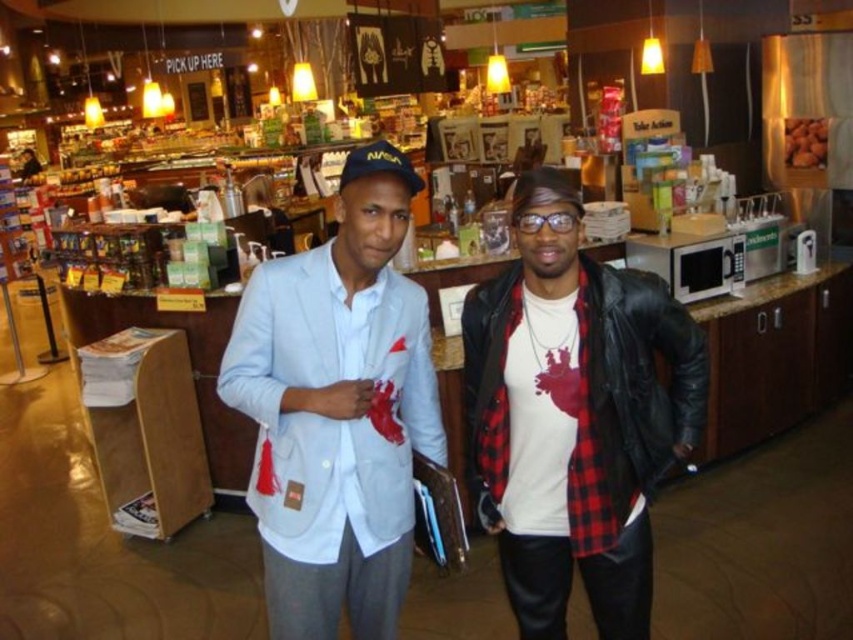
Is point (538, 515) farther from camera compared to point (350, 598)?

No.

Is matte black jacket at center wider than light blue fabric jacket at center?

Yes, matte black jacket at center is wider than light blue fabric jacket at center.

Is point (691, 317) behind point (344, 208)?

Yes, it is.

Locate an element on the screen. matte black jacket at center is located at coordinates (573, 416).

Does point (637, 284) lie in front of point (271, 445)?

No.

Is point (645, 572) more distant than point (430, 424)?

No, (645, 572) is closer to viewer.

The width and height of the screenshot is (853, 640). What do you see at coordinates (573, 416) in the screenshot? I see `light blue cotton blazer at center` at bounding box center [573, 416].

The width and height of the screenshot is (853, 640). Identify the location of light blue cotton blazer at center. [x=573, y=416].

Which is more to the left, matte black jacket at center or brown matte nuts at upper right?

matte black jacket at center

Between point (669, 422) and point (822, 138), which one is positioned in front?

Point (669, 422)

Which is in front, point (573, 212) or point (815, 138)?

Point (573, 212) is more forward.

You are a GUI agent. You are given a task and a screenshot of the screen. Output one action in this format:
    pyautogui.click(x=<x>, y=<y>)
    Task: Click on the matte black jacket at center
    The image size is (853, 640).
    Given the screenshot: What is the action you would take?
    pyautogui.click(x=573, y=416)